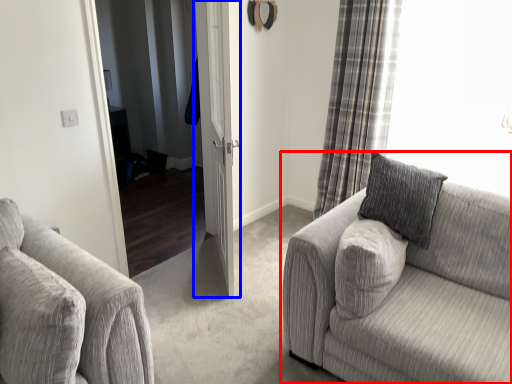
Question: Which of the following is the closest to the observer, studio couch (highlighted by a red box) or door (highlighted by a blue box)?

Choices:
 (A) studio couch
 (B) door

Answer: (A)